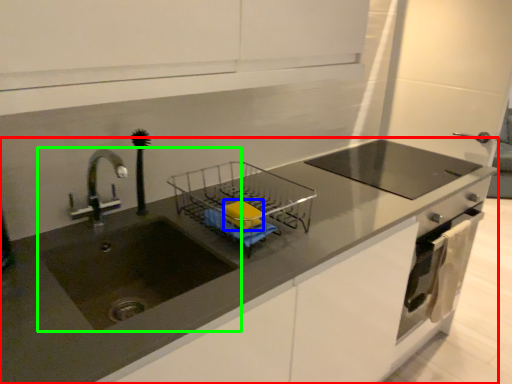
Question: Based on their relative distances, which object is farther from countertop (highlighted by a red box)? Choose from soap (highlighted by a blue box) and sink (highlighted by a green box).

Choices:
 (A) soap
 (B) sink

Answer: (A)